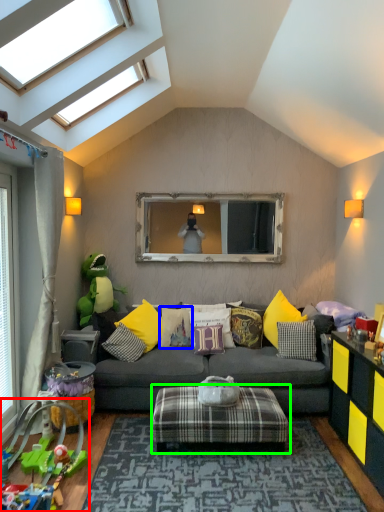
Question: Which object is positioned closest to toy (highlighted by a red box)? Select from pillow (highlighted by a blue box) and stool (highlighted by a green box).

Choices:
 (A) pillow
 (B) stool

Answer: (B)